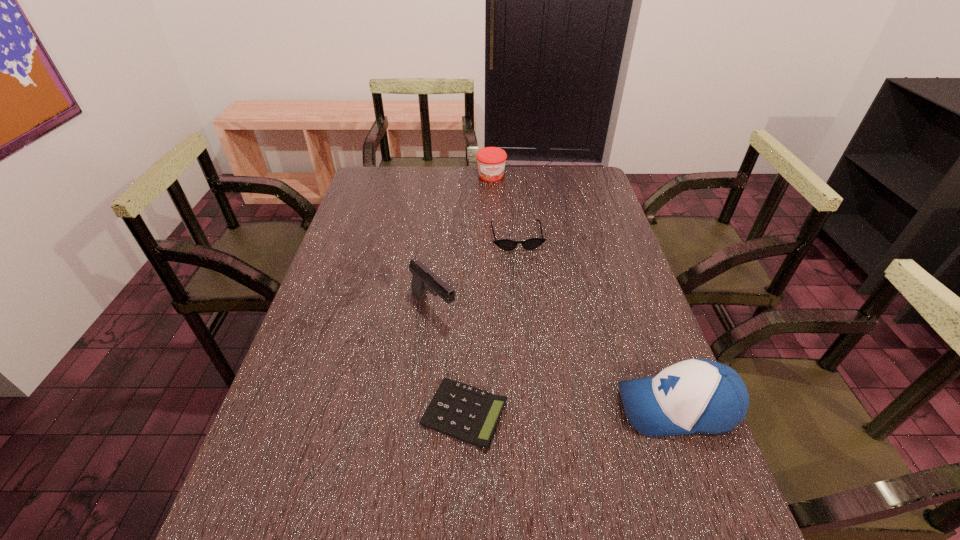
This screenshot has width=960, height=540. What are the coordinates of `object at the far edge` in the screenshot? It's located at (491, 161).

Where is `object that is at the right edge`? This screenshot has width=960, height=540. object that is at the right edge is located at coordinates (696, 396).

This screenshot has height=540, width=960. In order to click on free space at the near edge of the desktop in this screenshot , I will do `click(514, 488)`.

Image resolution: width=960 pixels, height=540 pixels. In the image, there is a desktop. Find the location of `free region at the left edge`. free region at the left edge is located at coordinates (329, 444).

Find the location of a particular element. Image resolution: width=960 pixels, height=540 pixels. blank area at the right edge is located at coordinates (564, 201).

Find the location of a particular element. Image resolution: width=960 pixels, height=540 pixels. vacant region at the far left corner of the desktop is located at coordinates (370, 196).

Find the location of a particular element. The width and height of the screenshot is (960, 540). unoccupied position between the third nearest object and the fourth nearest object is located at coordinates (475, 272).

Find the location of a particular element. unoccupied area between the third farthest object and the second farthest object is located at coordinates (475, 272).

What are the coordinates of `empty location between the pistol and the second shortest object` in the screenshot? It's located at (475, 272).

Locate an element on the screen. free space between the second shortest object and the rightmost object is located at coordinates (597, 322).